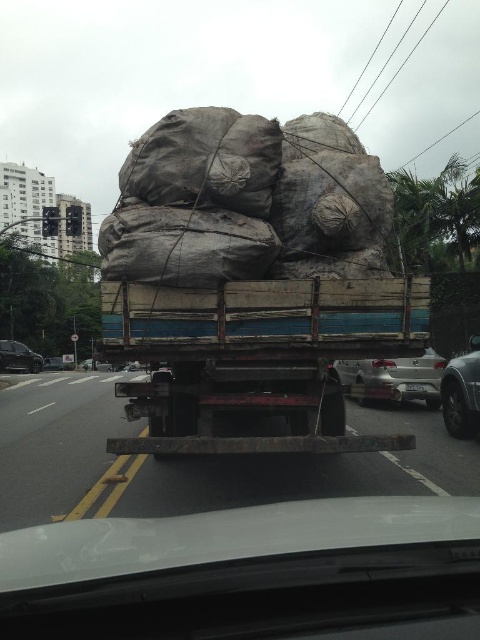
You are sitting in a car and looking out the window at the truck. There are two points marked on the road ahead. Based on your perspective, which point is closer to you, point (455,413) or point (11,346)?

Point (11,346) is closer to you because in the image, point (455,413) is positioned in front of point (11,346), meaning the latter is nearer to the observer.

You are driving a metallic silver car at right and want to overtake the wooden trailer truck at center on a two lane road. Considering their widths, is it safe to attempt passing in this situation?

The wooden trailer truck at center is wider than the metallic silver car at right. Since overtaking on a two lane road requires sufficient space to safely pass without obstruction, the trailer truck being wider may pose a risk due to its larger size, making it less safe to attempt passing unless there is ample clearance and visibility.

You are a passenger in a car and see the metallic silver car at right and the shiny black sedan at left in the image. Which vehicle is positioned higher in the scene?

The metallic silver car at right is positioned higher than the shiny black sedan at left in the scene.